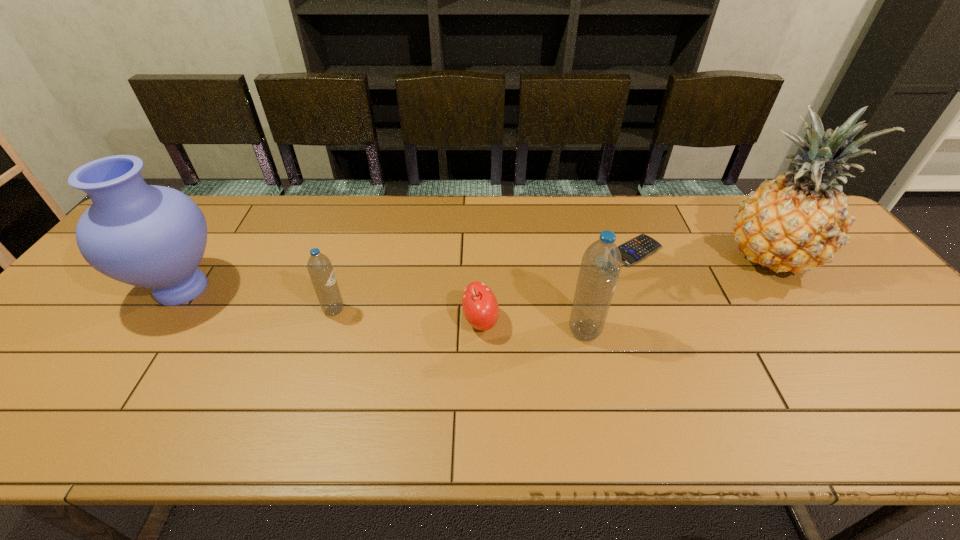
Identify the location of the farther water bottle. (320, 269).

I want to click on the fourth tallest object, so click(320, 269).

Identify the location of the nearer water bottle. Image resolution: width=960 pixels, height=540 pixels. (601, 263).

What are the coordinates of `the third object from right to left` in the screenshot? It's located at (601, 263).

Find the location of a particular element. This screenshot has width=960, height=540. vase is located at coordinates [149, 236].

You are a GUI agent. You are given a task and a screenshot of the screen. Output one action in this format:
    pyautogui.click(x=<x>, y=<y>)
    Task: Click on the leftmost object
    The width and height of the screenshot is (960, 540).
    Given the screenshot: What is the action you would take?
    pyautogui.click(x=149, y=236)

This screenshot has width=960, height=540. Identify the location of pineapple. (796, 222).

What are the coordinates of `the fifth tallest object` in the screenshot? It's located at (480, 306).

Locate an element on the screen. the third object from left to right is located at coordinates (480, 306).

At what (x,y) coordinates should I click in order to perform the action: click on calculator. Please return your answer as a coordinate pair (x, y). The width and height of the screenshot is (960, 540). Looking at the image, I should click on (638, 248).